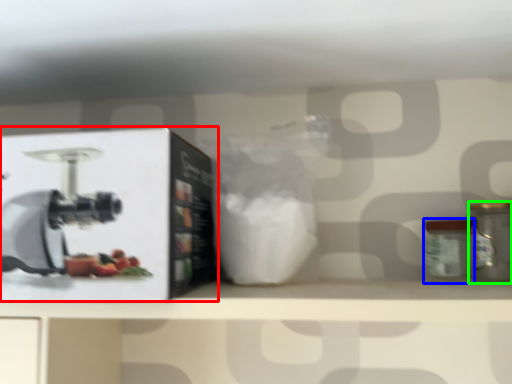
Question: Considering the real-world distances, which object is closest to wide (highlighted by a red box)? glass jar (highlighted by a blue box) or kitchen appliance (highlighted by a green box).

Choices:
 (A) glass jar
 (B) kitchen appliance

Answer: (A)